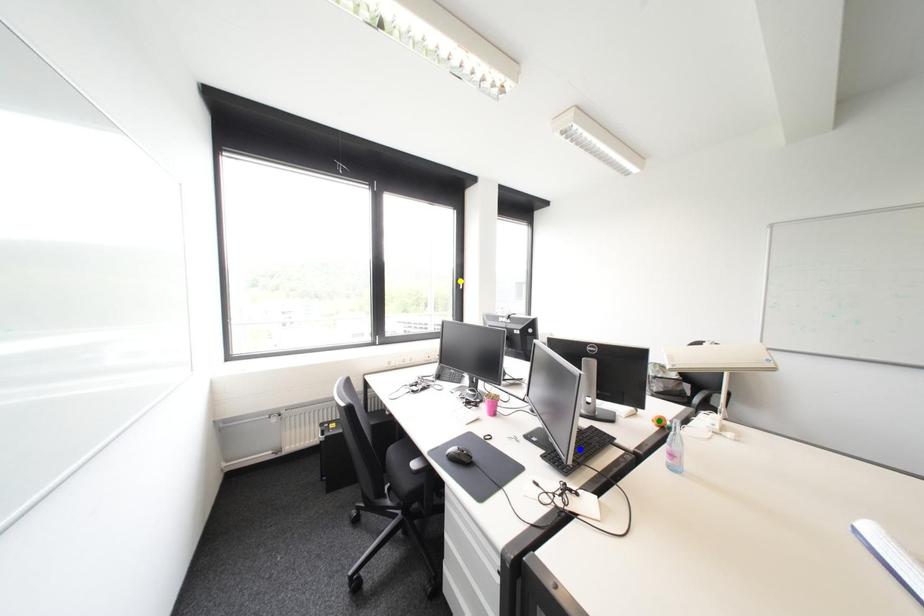
Order these from nearest to farthest:
1. blue point
2. green point
3. yellow point

blue point → green point → yellow point